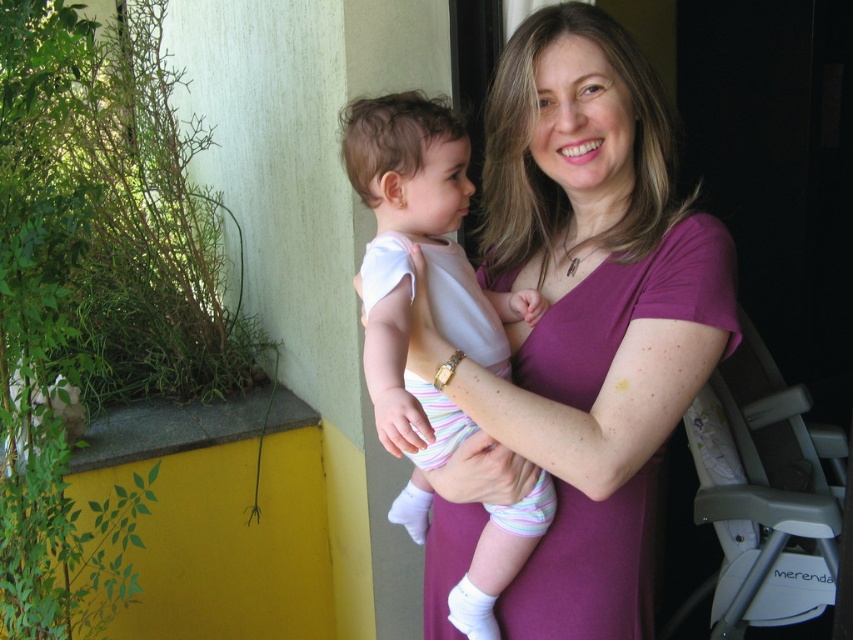
Question: Which point is closer to the camera taking this photo?

Choices:
 (A) (444, 173)
 (B) (554, 380)

Answer: (A)

Question: Can you confirm if purple smooth shirt at center is thinner than white cotton onesie at center?

Choices:
 (A) yes
 (B) no

Answer: (B)

Question: Which of the following is the farthest from the observer?

Choices:
 (A) [496, 384]
 (B) [480, 294]

Answer: (B)

Question: Is purple smooth shirt at center smaller than white cotton onesie at center?

Choices:
 (A) no
 (B) yes

Answer: (A)

Question: From the image, what is the correct spatial relationship of purple smooth shirt at center in relation to white cotton onesie at center?

Choices:
 (A) below
 (B) above

Answer: (B)